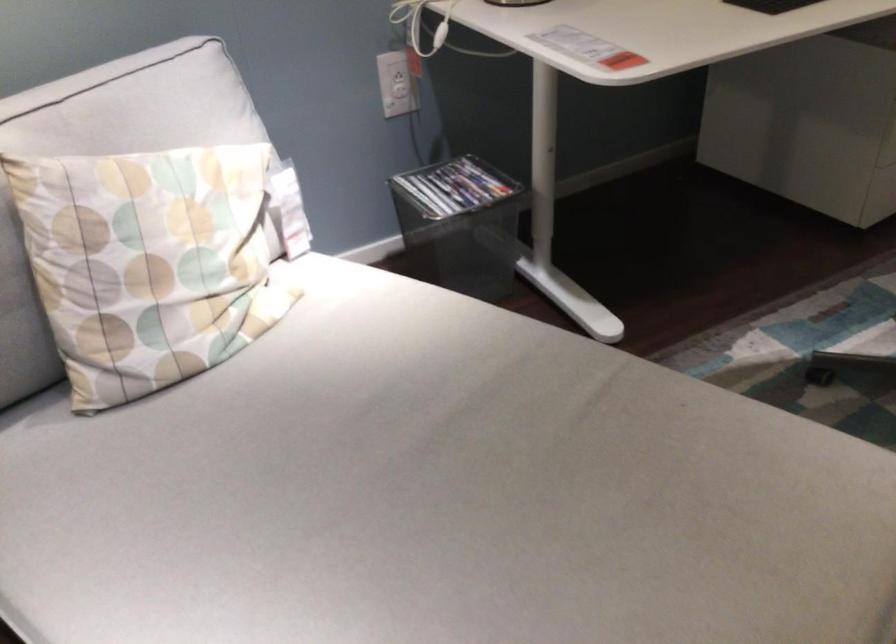
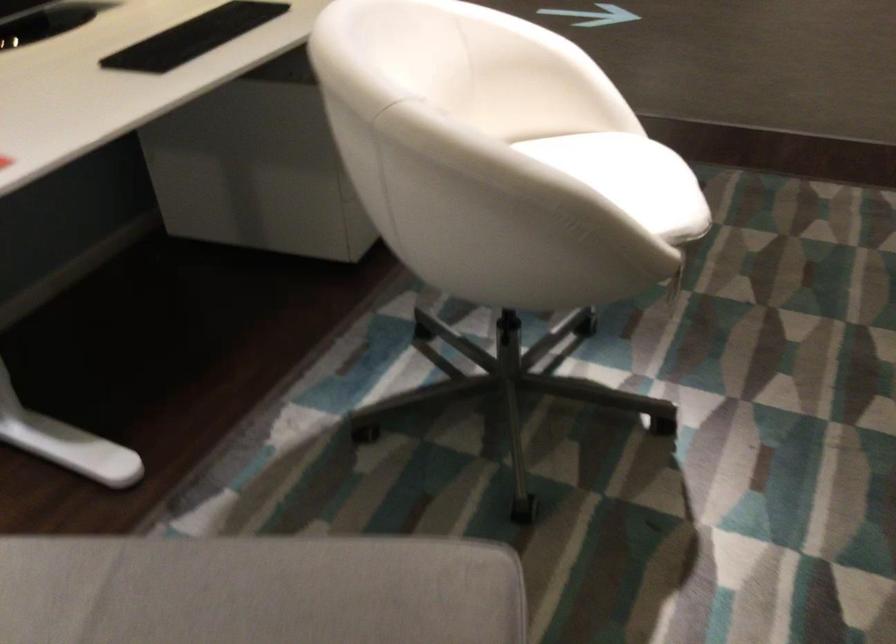
Question: The images are taken continuously from a first-person perspective. In which direction is your viewpoint rotating?

Choices:
 (A) Left
 (B) Right
 (C) Up
 (D) Down

Answer: (B)